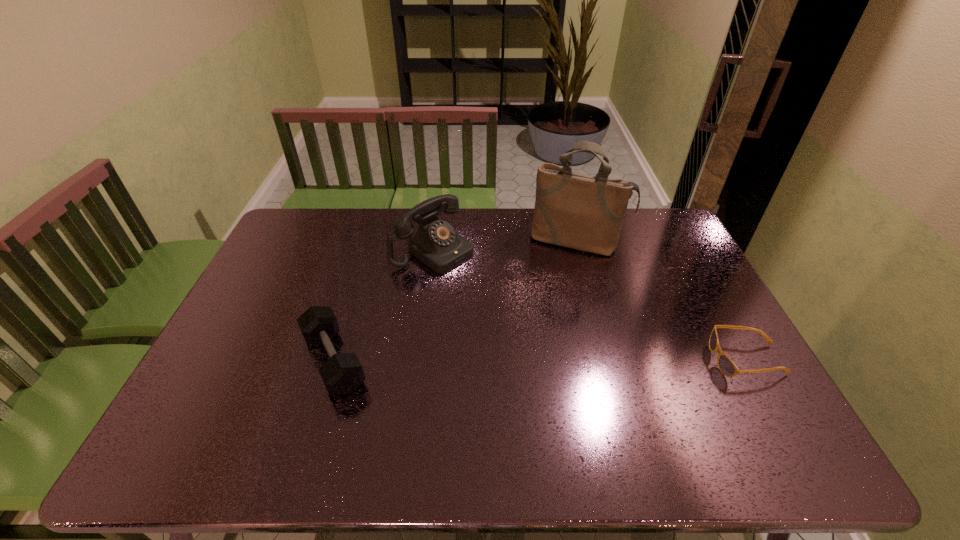
The width and height of the screenshot is (960, 540). What are the coordinates of `dumbbell` in the screenshot? It's located at (342, 373).

Identify the location of the shortest object. (727, 367).

Find the location of `the rightmost object`. the rightmost object is located at coordinates (727, 367).

Where is `shoulder bag`? The width and height of the screenshot is (960, 540). shoulder bag is located at coordinates (578, 211).

Image resolution: width=960 pixels, height=540 pixels. Find the location of `the third object from left to right`. the third object from left to right is located at coordinates (578, 211).

Find the location of `telephone`. telephone is located at coordinates click(x=436, y=244).

You are a GUI agent. You are given a task and a screenshot of the screen. Output one action in this format:
    pyautogui.click(x=<x>, y=<y>)
    Task: Click on the vacant space located 0.220m on the left of the second shortest object
    This screenshot has width=960, height=540.
    Given the screenshot: What is the action you would take?
    pyautogui.click(x=213, y=361)

Locate an element on the screen. Image resolution: width=960 pixels, height=540 pixels. vacant space located on the front-facing side of the shortest object is located at coordinates (x=631, y=360).

Locate an element on the screen. This screenshot has height=540, width=960. vacant area situated on the front-facing side of the shortest object is located at coordinates (680, 360).

Where is `free location located 0.360m on the front-facing side of the shortest object`? Image resolution: width=960 pixels, height=540 pixels. free location located 0.360m on the front-facing side of the shortest object is located at coordinates (579, 360).